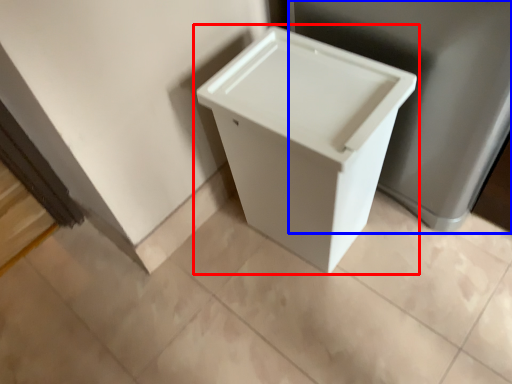
Question: Which of the following is the farthest to the observer, waste container (highlighted by a red box) or porcelain (highlighted by a blue box)?

Choices:
 (A) waste container
 (B) porcelain

Answer: (A)